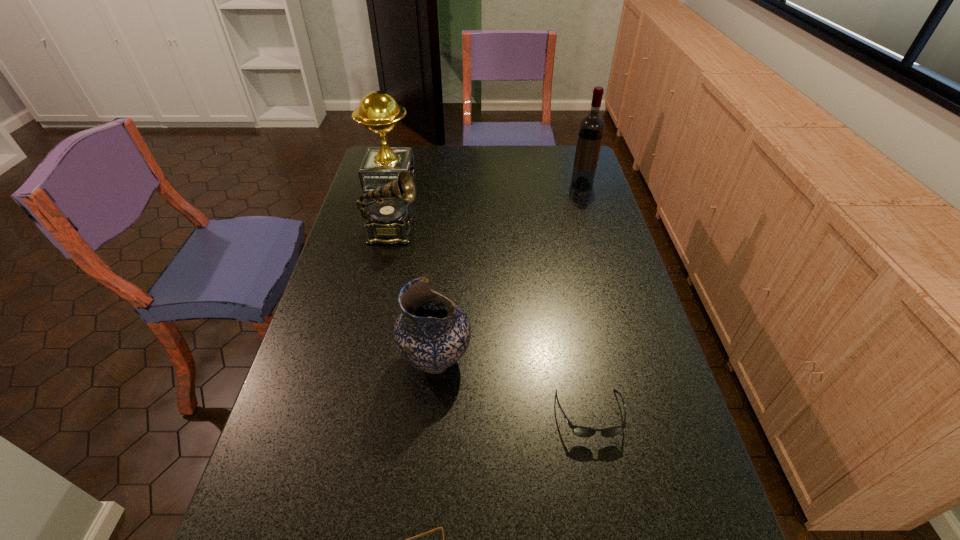
You are a GUI agent. You are given a task and a screenshot of the screen. Output one action in this format:
    pyautogui.click(x=<x>, y=<y>)
    Task: Click on the second closest object relative to the phonograph record
    
    Given the screenshot: What is the action you would take?
    pyautogui.click(x=432, y=333)

Locate an element on the screen. The width and height of the screenshot is (960, 540). object that stands as the closest to the award is located at coordinates tap(389, 221).

Where is `blank area in the image that satisfies the following two spatial constraints: 1. on the front-facing side of the pottery; 2. on the left side of the award`? blank area in the image that satisfies the following two spatial constraints: 1. on the front-facing side of the pottery; 2. on the left side of the award is located at coordinates (342, 359).

Locate an element on the screen. This screenshot has height=540, width=960. free location that satisfies the following two spatial constraints: 1. on the front-facing side of the award; 2. on the left side of the rightmost object is located at coordinates (389, 185).

Locate an element on the screen. free region that satisfies the following two spatial constraints: 1. on the back side of the pottery; 2. on the horn of the third farthest object is located at coordinates (446, 233).

This screenshot has height=540, width=960. Identify the location of vacant point that satisfies the following two spatial constraints: 1. on the horn of the pottery; 2. on the right side of the phonograph record. (363, 359).